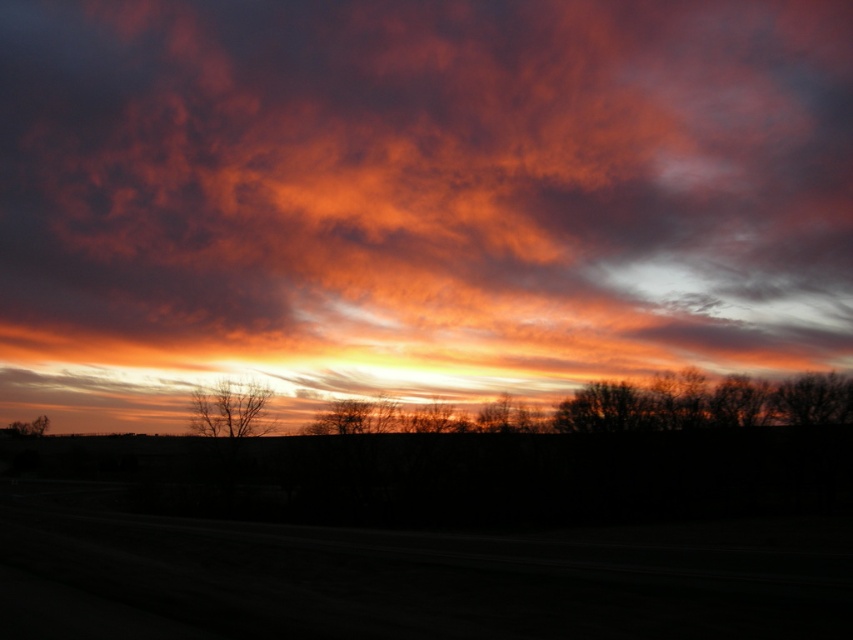
Question: Is cloudy sky at upper center to the left of bare branches at center from the viewer's perspective?

Choices:
 (A) yes
 (B) no

Answer: (B)

Question: Which object is positioned closest to the silhouetted bare branches at center?

Choices:
 (A) brown matte tree at center
 (B) cloudy sky at upper center
 (C) brown matte tree at lower left

Answer: (A)

Question: Which of the following is the closest to the observer?

Choices:
 (A) silhouetted bare branches at center
 (B) bare branches at center
 (C) cloudy sky at upper center

Answer: (A)

Question: Which of the following is the closest to the observer?

Choices:
 (A) (637, 429)
 (B) (352, 269)

Answer: (A)

Question: Can you confirm if silhouette bare tree at right is positioned to the right of brown matte tree at center?

Choices:
 (A) yes
 (B) no

Answer: (A)

Question: Can you confirm if silhouetted bare branches at center is wider than silhouette bare tree at right?

Choices:
 (A) yes
 (B) no

Answer: (B)